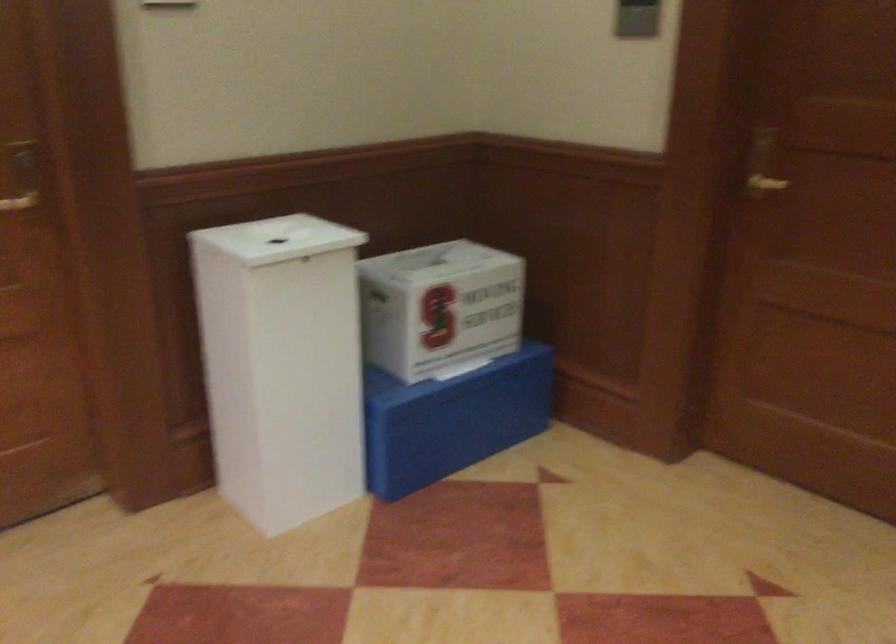
This screenshot has width=896, height=644. I want to click on white cardboard box, so click(440, 307).